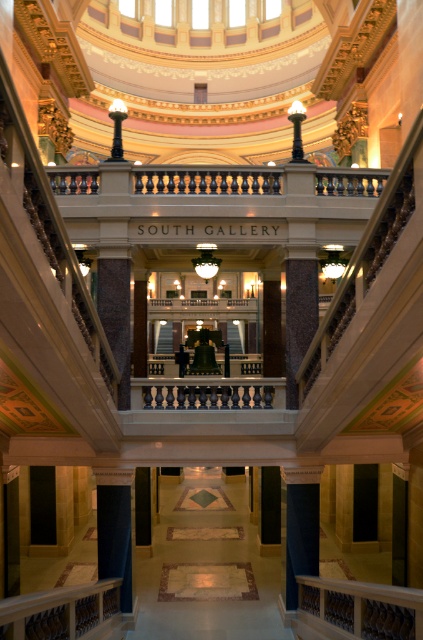
You are standing at the entrance of the grand building and want to reach the South Gallery. The polished marble staircase at right is the only staircase available. Where should you head to find it?

The polished marble staircase at right is located at point (362, 268), so you should head towards the right side of the building to find it.